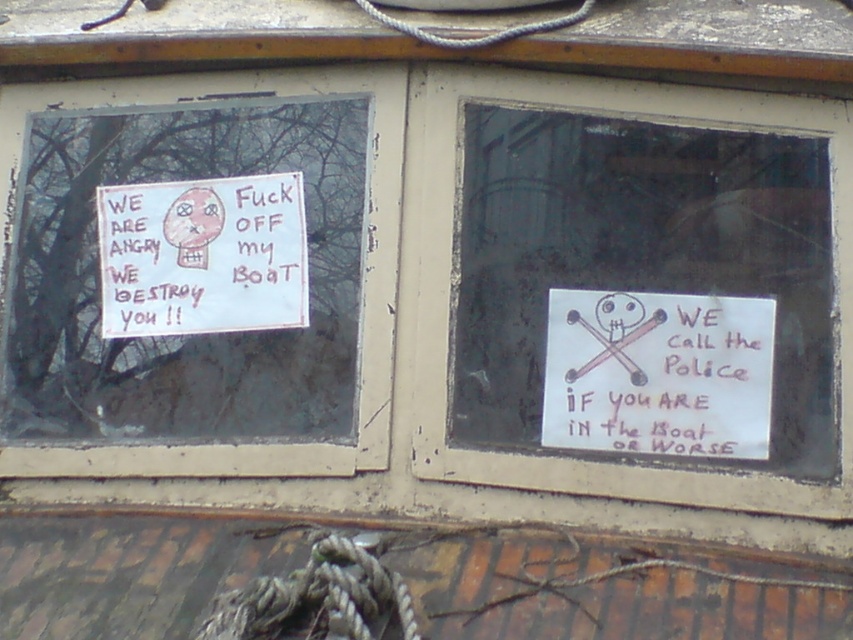
You are a curious observer standing outside the boat. You notice two white paper signs. Which sign can you see more clearly, the white paper sign at upper left or the white paper sign at right?

The white paper sign at upper left is in front of the white paper sign at right, so you can see the white paper sign at upper left more clearly.

You are standing in front of the boat and notice two signs. The left window has a sign with angry text, and the right window has a white paper sign at right. Which sign is positioned closer to the bottom of the boat?

The white paper sign at right is located at point (659,372), which is closer to the bottom of the boat compared to the left window sign. Therefore, the white paper sign at right is positioned closer to the bottom.